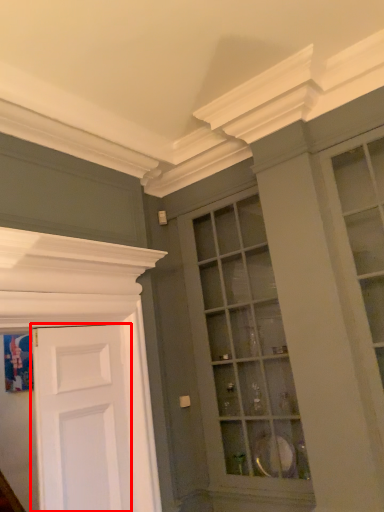
Question: From the image's perspective, considering the relative positions of door (annotated by the red box) and window in the image provided, where is door (annotated by the red box) located with respect to the staircase?

Choices:
 (A) above
 (B) below

Answer: (B)